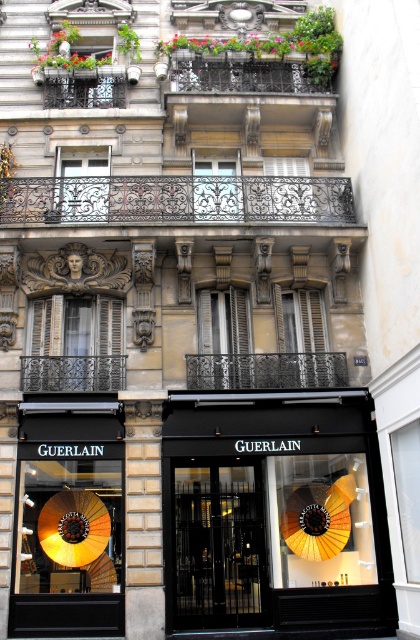
Based on the photo, you are a delivery person with a package that requires a 20 feet wide space to maneuver. You are standing in front of the building and need to place your delivery cart between the black glass door at center and the shiny gold umbrella at lower left. Is there enough space to fit your cart?

The distance between the black glass door at center and the shiny gold umbrella at lower left is 23.73 feet, which is more than the required 20 feet. Therefore, there is sufficient space to maneuver the delivery cart between them.

You are a delivery person approaching the building and need to enter through the black glass door at center. There is a shiny gold umbrella at lower left nearby. Which object is closer to you as you approach the building?

The black glass door at center is closer to the viewer than the shiny gold umbrella at lower left, so the delivery person should approach the black glass door at center first.